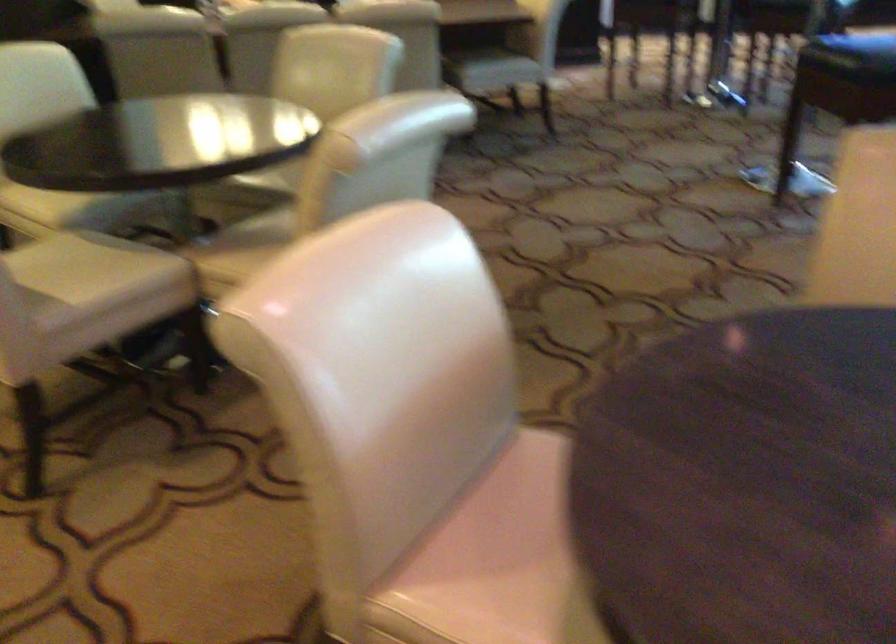
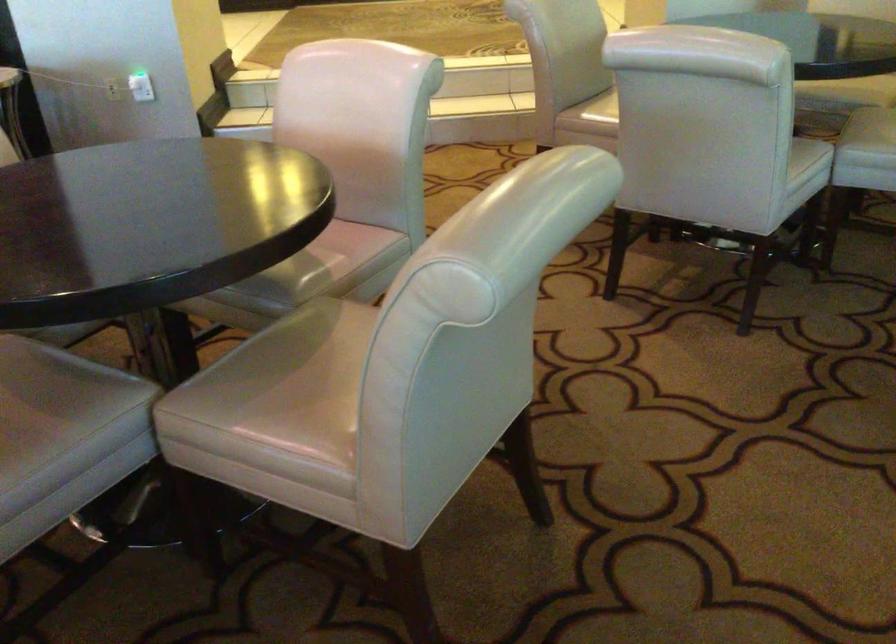
Where in the second image is the point corresponding to point (285, 181) from the first image?

(874, 125)